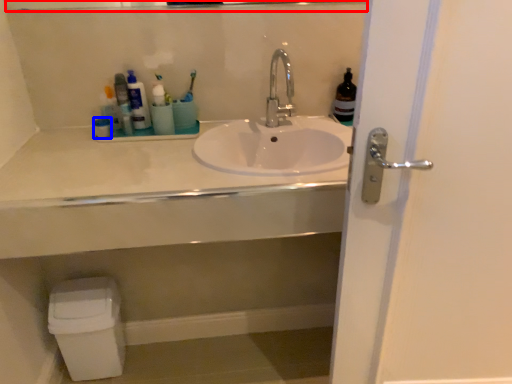
Question: Which point is further to the camera, mirror (highlighted by a red box) or toiletry (highlighted by a blue box)?

Choices:
 (A) mirror
 (B) toiletry

Answer: (B)